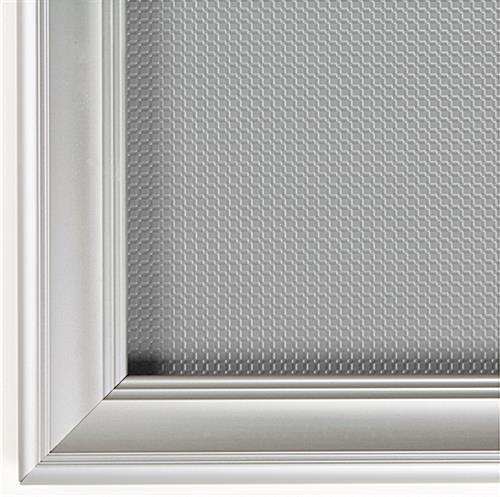
Where is `the bottom piece of wood that makes up the frame`? This screenshot has height=497, width=500. the bottom piece of wood that makes up the frame is located at coordinates (211, 445).